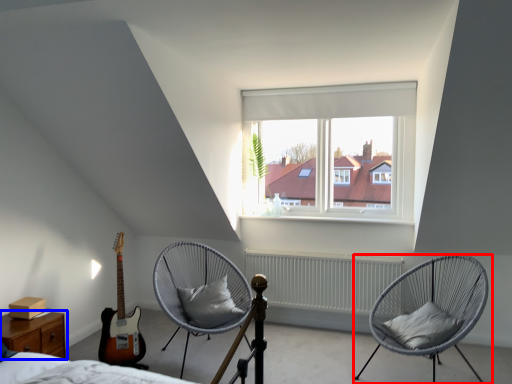
Question: Among these objects, which one is nearest to the camera, chair (highlighted by a red box) or nightstand (highlighted by a blue box)?

Choices:
 (A) chair
 (B) nightstand

Answer: (B)